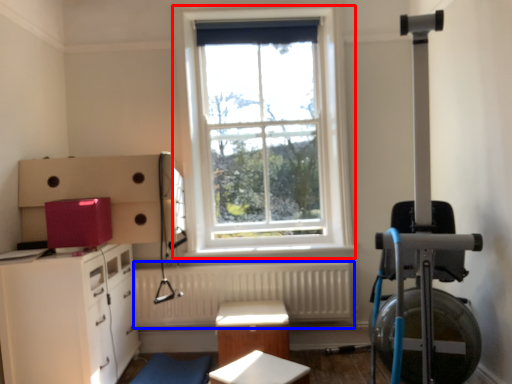
Question: Among these objects, which one is nearest to the camera, window (highlighted by a red box) or radiator (highlighted by a blue box)?

Choices:
 (A) window
 (B) radiator

Answer: (B)